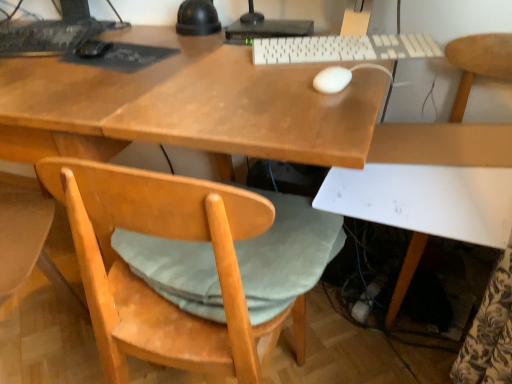
In order to click on empty space that is to the right of black matte keyboard at upper left, the second computer keyboard from the right in this screenshot , I will do `click(120, 38)`.